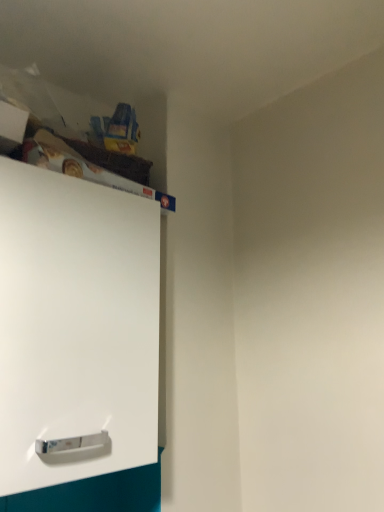
The image size is (384, 512). Describe the element at coordinates (75, 328) in the screenshot. I see `white matte cabinet at upper left` at that location.

Where is `white matte cabinet at upper left`? white matte cabinet at upper left is located at coordinates (75, 328).

Find the location of `white matte cabinet at upper left`. white matte cabinet at upper left is located at coordinates (75, 328).